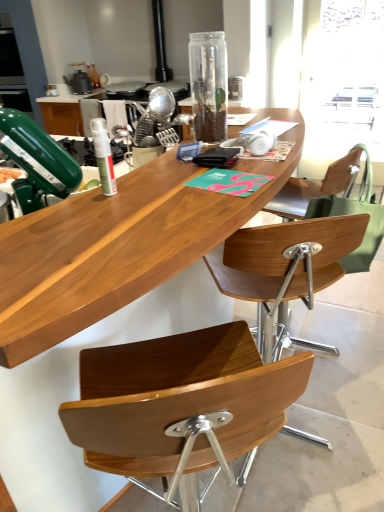
The height and width of the screenshot is (512, 384). Identify the location of unoccupied area in front of white matte spray can at center, arranged as the first bottle when ordered from the bottom. (94, 221).